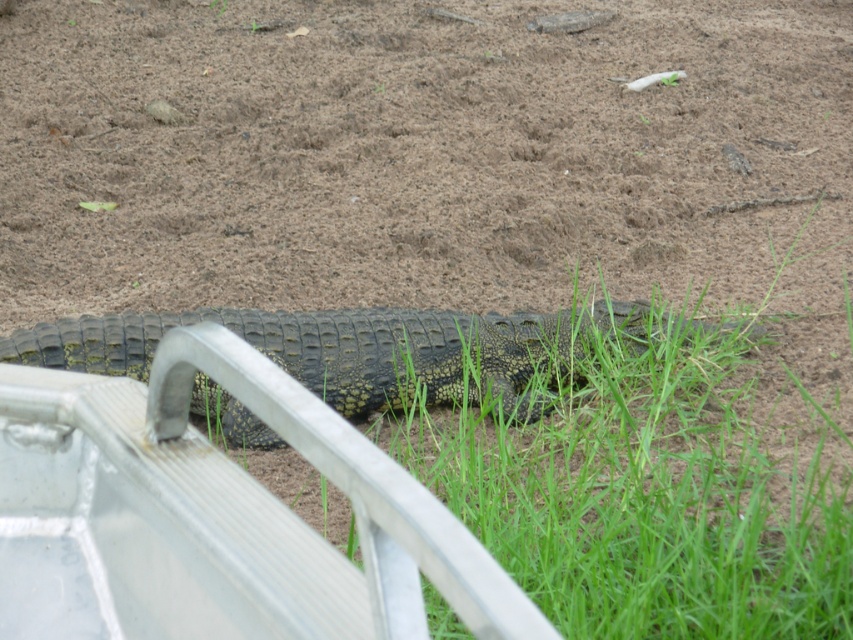
Can you confirm if silver metallic rail at lower left is positioned below green grass at center?

Incorrect, silver metallic rail at lower left is not positioned below green grass at center.

Can you confirm if silver metallic rail at lower left is smaller than green grass at center?

Yes.

The image size is (853, 640). I want to click on silver metallic rail at lower left, so click(215, 515).

Which is below, green grass at center or greenish-brown scaly crocodile at center?

greenish-brown scaly crocodile at center is below.

I want to click on green grass at center, so click(x=650, y=490).

Is silver metallic rail at lower left behind greenish-brown scaly crocodile at center?

No, silver metallic rail at lower left is in front of greenish-brown scaly crocodile at center.

Does point (10, 371) come farther from viewer compared to point (436, 314)?

No, (10, 371) is closer to viewer.

At what (x,y) coordinates should I click in order to perform the action: click on silver metallic rail at lower left. Please return your answer as a coordinate pair (x, y). The height and width of the screenshot is (640, 853). Looking at the image, I should click on [x=215, y=515].